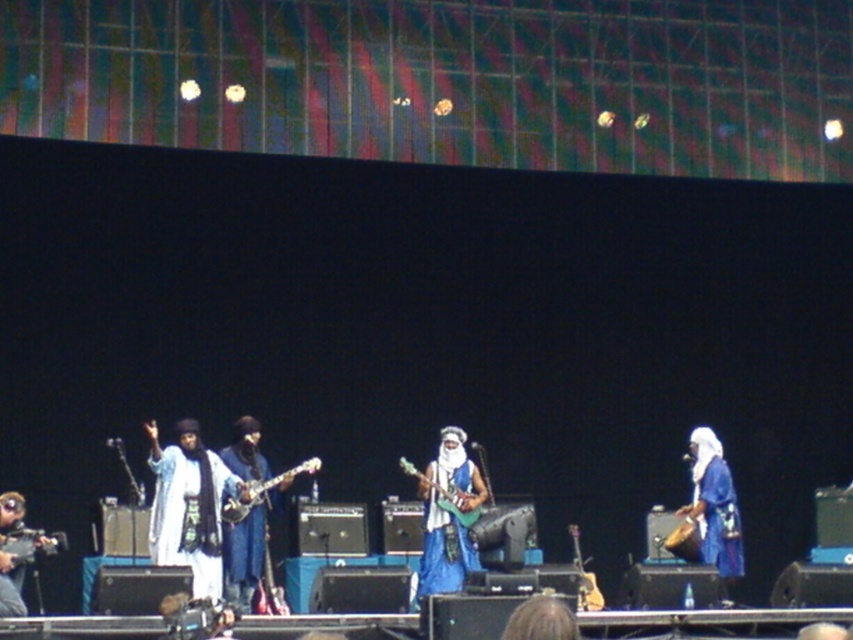
You are standing at the point marked as point (714, 509). What is the color of the fabric directly beneath your feet?

The point (714, 509) is on blue fabric at center, so the color of the fabric directly beneath your feet is blue.

You are a stagehand who needs to place a microphone stand at position point 0.870, 0.012. Is the white cotton guitar at center already occupying that spot?

The white cotton guitar at center is located at point [9,556], so yes, it is occupying that spot.